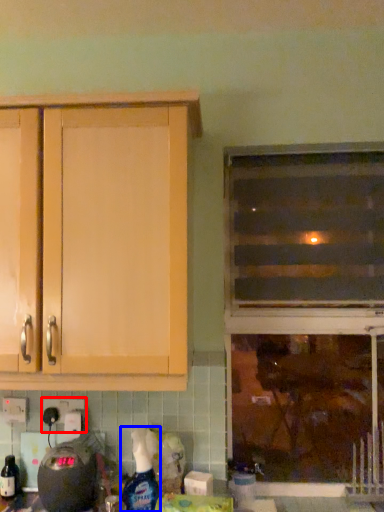
Question: Which of the following is the farthest to the observer, electric outlet (highlighted by a red box) or cleaning product (highlighted by a blue box)?

Choices:
 (A) electric outlet
 (B) cleaning product

Answer: (A)